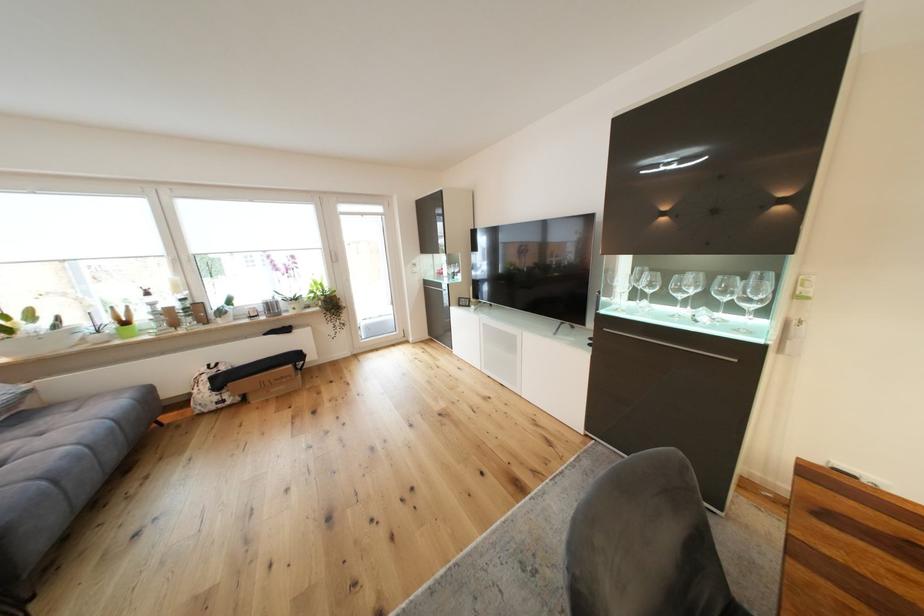
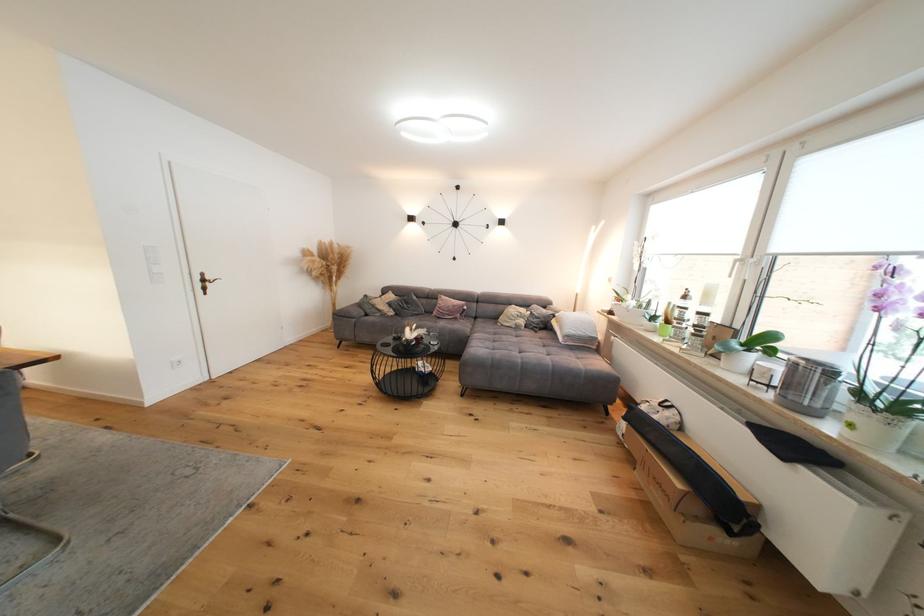
Where in the second image is the point corresponding to point 298,334 from the first image?

(793, 461)